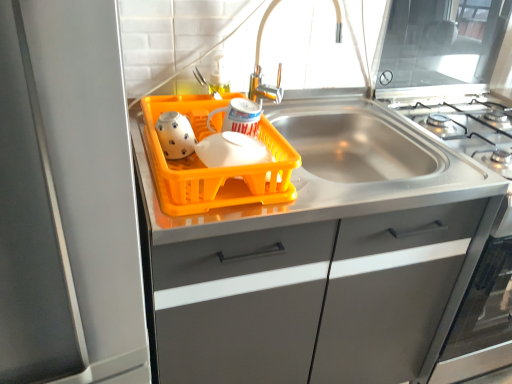
Locate an element on the screen. This screenshot has height=384, width=512. empty space that is ontop of orange plastic basket at center (from a real-world perspective) is located at coordinates (215, 114).